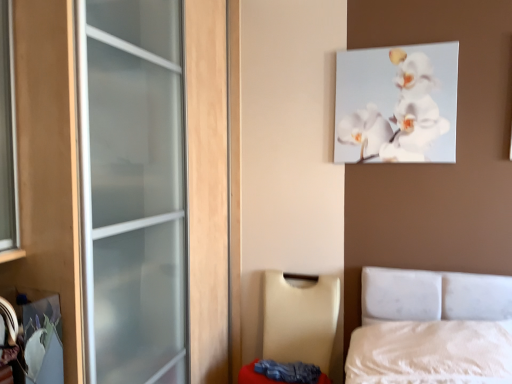
Question: In terms of width, does beige leather chair at lower center look wider or thinner when compared to white fabric mattress at lower right?

Choices:
 (A) thin
 (B) wide

Answer: (B)

Question: Is point (263, 339) closer or farther from the camera than point (240, 380)?

Choices:
 (A) farther
 (B) closer

Answer: (A)

Question: Estimate the real-world distances between objects in this image. Which object is closer to the white glossy orchid at upper center?

Choices:
 (A) white fabric mattress at lower right
 (B) beige leather chair at lower center

Answer: (B)

Question: Considering the real-world distances, which object is closest to the beige leather chair at lower center?

Choices:
 (A) white glossy orchid at upper center
 (B) white fabric mattress at lower right

Answer: (B)